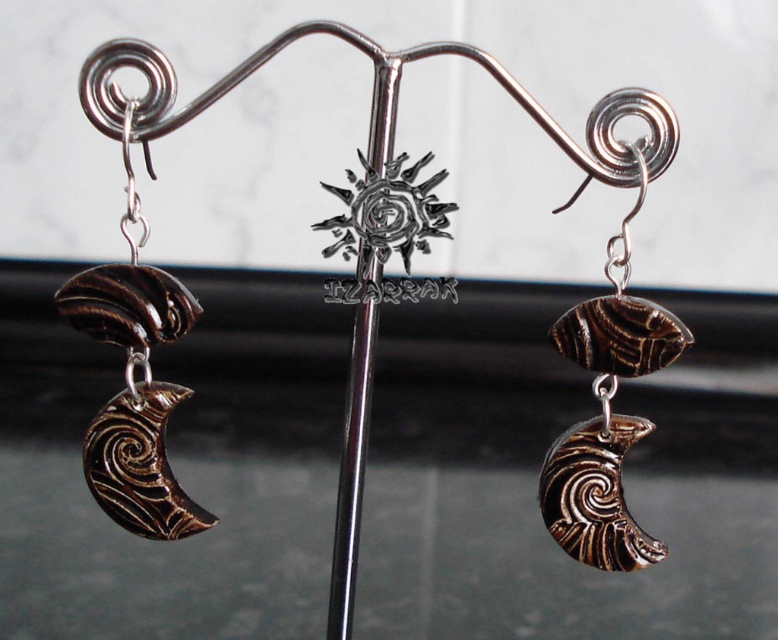
You are an artisan examining the earrings displayed on the metal stand. You need to determine which component takes up more space between the brown polished stone crescent moon at center and the polished silver rod at center. Which one is it?

The polished silver rod at center occupies more space than the brown polished stone crescent moon at center.

You are a jeweler who needs to package these earrings. The box you have is 5 inches wide. Can the brown polished stone crescent moon at center and the polished silver rod at center fit side by side in the box without overlapping?

The brown polished stone crescent moon at center and the polished silver rod at center are 5.59 inches apart. Since the box is only 5 inches wide, they cannot fit side by side without overlapping.